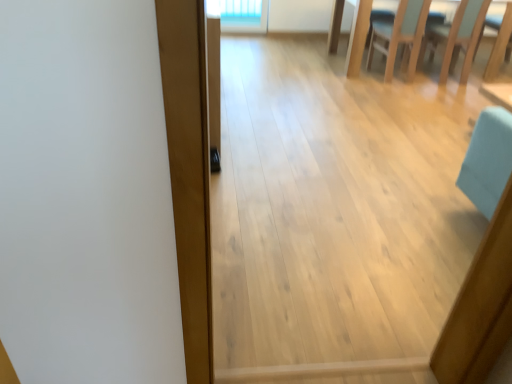
Question: Based on their sizes in the image, would you say light brown wood plank at center is bigger or smaller than light wood chair at upper right?

Choices:
 (A) big
 (B) small

Answer: (B)

Question: Relative to light wood chair at upper right, is light brown wood plank at center in front or behind?

Choices:
 (A) front
 (B) behind

Answer: (A)

Question: Which object is the closest to the light brown wood plank at center?

Choices:
 (A) light blue fabric chair at upper right
 (B) light wood chair at upper right

Answer: (B)

Question: Which object is the farthest from the light blue fabric chair at upper right?

Choices:
 (A) light wood chair at upper right
 (B) light brown wood plank at center

Answer: (B)